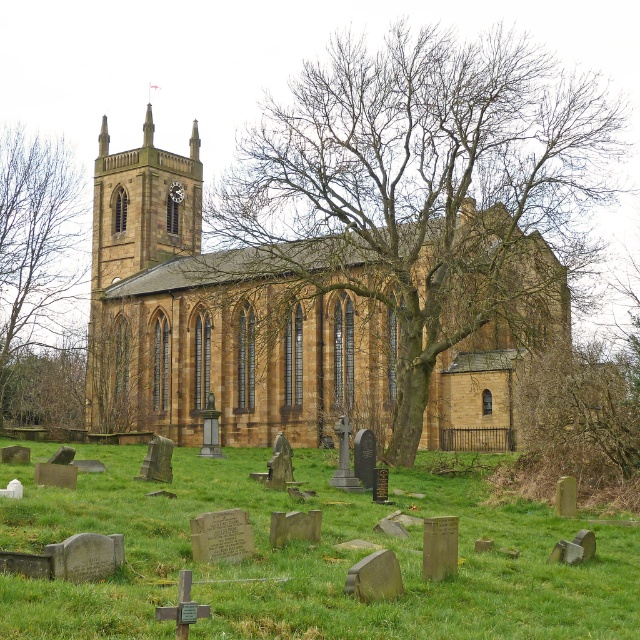
Question: Based on their relative distances, which object is farther from the bare branches at center?

Choices:
 (A) brown stone clock tower at upper left
 (B) brown stone tree at upper center

Answer: (B)

Question: Is bare branches at center to the right of green grass at lower center from the viewer's perspective?

Choices:
 (A) yes
 (B) no

Answer: (A)

Question: Is bare branches at center positioned behind brown stone clock tower at upper left?

Choices:
 (A) yes
 (B) no

Answer: (B)

Question: Estimate the real-world distances between objects in this image. Which object is closer to the bare branches at center?

Choices:
 (A) green grass at lower center
 (B) brown stone clock tower at upper left

Answer: (A)

Question: Among these objects, which one is nearest to the camera?

Choices:
 (A) green grass at lower center
 (B) brown stone clock tower at upper left

Answer: (A)

Question: Is brown stone clock tower at upper left to the left of brown stone tree at upper center from the viewer's perspective?

Choices:
 (A) yes
 (B) no

Answer: (B)